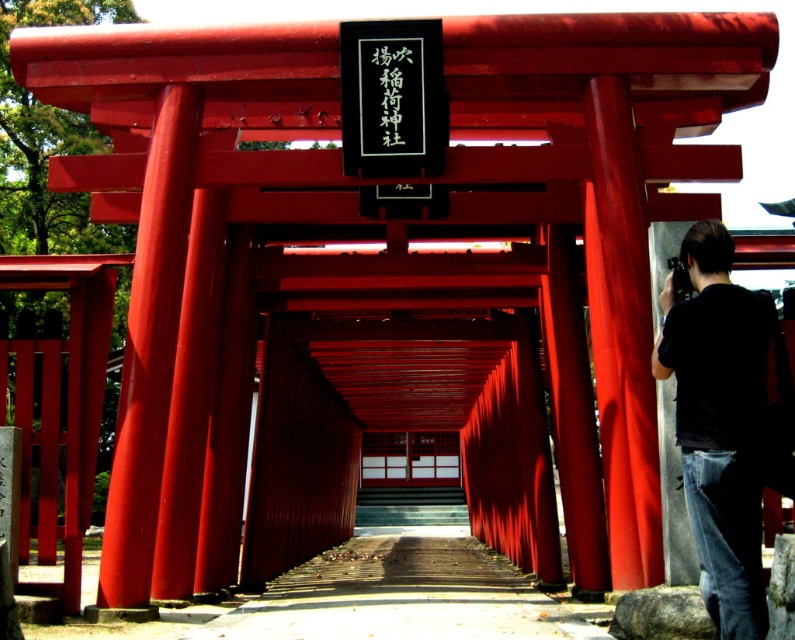
Question: Which of the following is the closest to the observer?

Choices:
 (A) (405, 540)
 (B) (747, 563)

Answer: (B)

Question: Is black cotton shirt at right below wooden planks at center?

Choices:
 (A) no
 (B) yes

Answer: (A)

Question: Is black cotton shirt at right positioned before wooden planks at center?

Choices:
 (A) no
 (B) yes

Answer: (B)

Question: Which of the following is the farthest from the observer?

Choices:
 (A) (720, 520)
 (B) (499, 604)

Answer: (B)

Question: Does black cotton shirt at right have a lesser width compared to wooden planks at center?

Choices:
 (A) yes
 (B) no

Answer: (A)